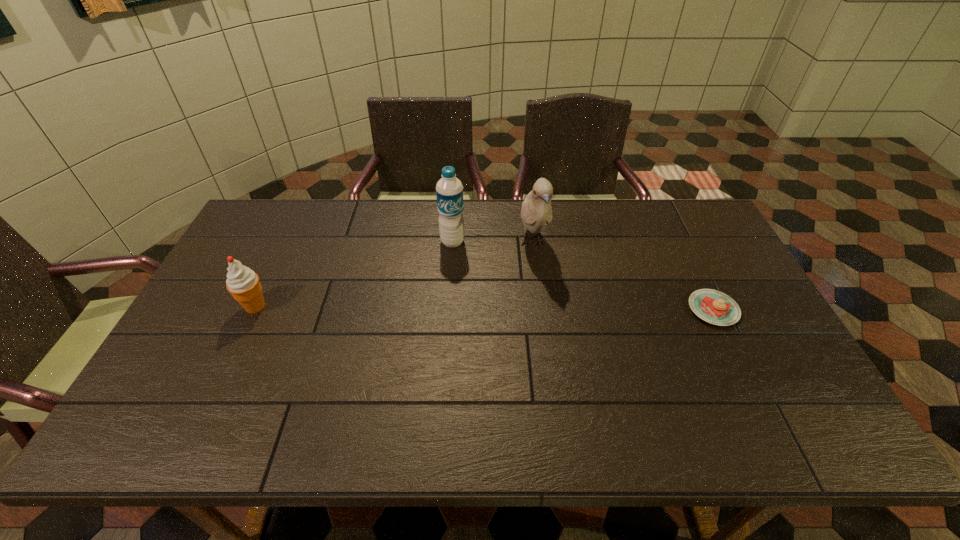
Identify the location of free location located at the beak of the bird. The height and width of the screenshot is (540, 960). pos(559,355).

Identify the location of vacant space located on the label of the second object from left to right. (436, 298).

What are the coordinates of `free space located on the label of the second object from left to right` in the screenshot? It's located at (438, 293).

This screenshot has height=540, width=960. I want to click on free space located 0.360m on the label of the second object from left to right, so (424, 339).

At what (x,y) coordinates should I click in order to perform the action: click on bird at the far edge. Please return your answer as a coordinate pair (x, y). This screenshot has width=960, height=540. Looking at the image, I should click on (536, 211).

Locate an element on the screen. This screenshot has width=960, height=540. water bottle situated at the far edge is located at coordinates pos(449,190).

This screenshot has height=540, width=960. Identify the location of object present at the left edge. (243, 283).

You are a GUI agent. You are given a task and a screenshot of the screen. Output one action in this format:
    pyautogui.click(x=<x>, y=<y>)
    Task: Click on the object that is at the right edge
    Image resolution: width=960 pixels, height=540 pixels.
    Given the screenshot: What is the action you would take?
    pyautogui.click(x=712, y=306)

Where is `blank space at the far edge of the desktop`? This screenshot has width=960, height=540. blank space at the far edge of the desktop is located at coordinates pos(648,220).

I want to click on vacant space at the near edge, so click(x=400, y=382).